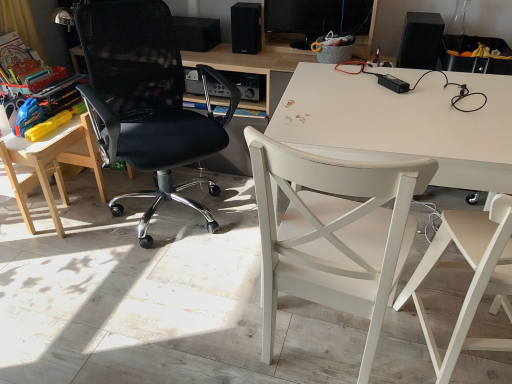
Locate an element on the screen. This screenshot has width=512, height=384. vacant space positioned to the left of white wood chair at center, the second chair positioned from the right is located at coordinates (203, 315).